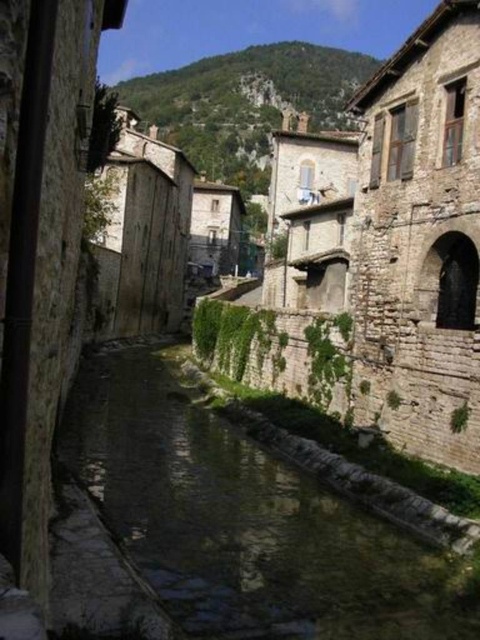
Question: Does green mossy stone stream at center have a greater width compared to rustic stone hillside at upper center?

Choices:
 (A) no
 (B) yes

Answer: (A)

Question: Which point is closer to the camera taking this photo?

Choices:
 (A) (233, 160)
 (B) (199, 579)

Answer: (B)

Question: Among these objects, which one is farthest from the camera?

Choices:
 (A) rustic stone hillside at upper center
 (B) green mossy stone stream at center

Answer: (A)

Question: Can you confirm if green mossy stone stream at center is smaller than rustic stone hillside at upper center?

Choices:
 (A) yes
 (B) no

Answer: (A)

Question: Considering the relative positions of green mossy stone stream at center and rustic stone hillside at upper center in the image provided, where is green mossy stone stream at center located with respect to rustic stone hillside at upper center?

Choices:
 (A) right
 (B) left

Answer: (A)